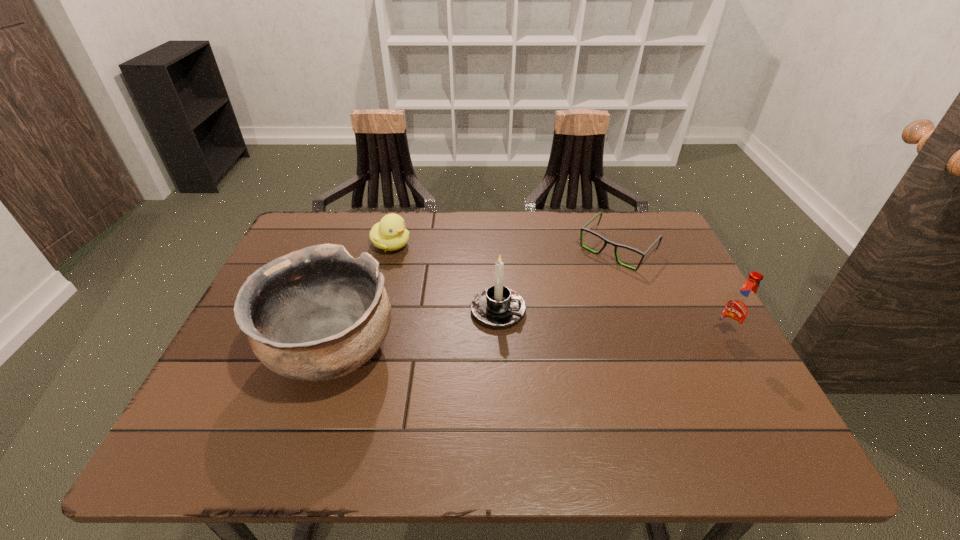
Where is `free spot that satisfies the following two spatial constraints: 1. on the back side of the pottery; 2. on the right side of the second shortest object`? Image resolution: width=960 pixels, height=540 pixels. free spot that satisfies the following two spatial constraints: 1. on the back side of the pottery; 2. on the right side of the second shortest object is located at coordinates (367, 245).

At what (x,y) coordinates should I click in order to perform the action: click on free space that satisfies the following two spatial constraints: 1. on the front side of the root beer; 2. on the right side of the duckling. Please return your answer as a coordinate pair (x, y). Looking at the image, I should click on (368, 336).